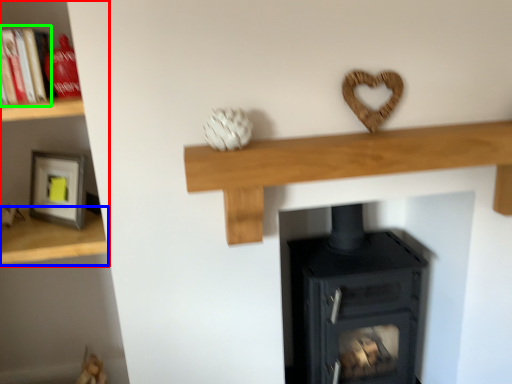
Question: Which object is the closest to the shelf (highlighted by a red box)? Choose among these: shelf (highlighted by a blue box) or book (highlighted by a green box).

Choices:
 (A) shelf
 (B) book

Answer: (A)